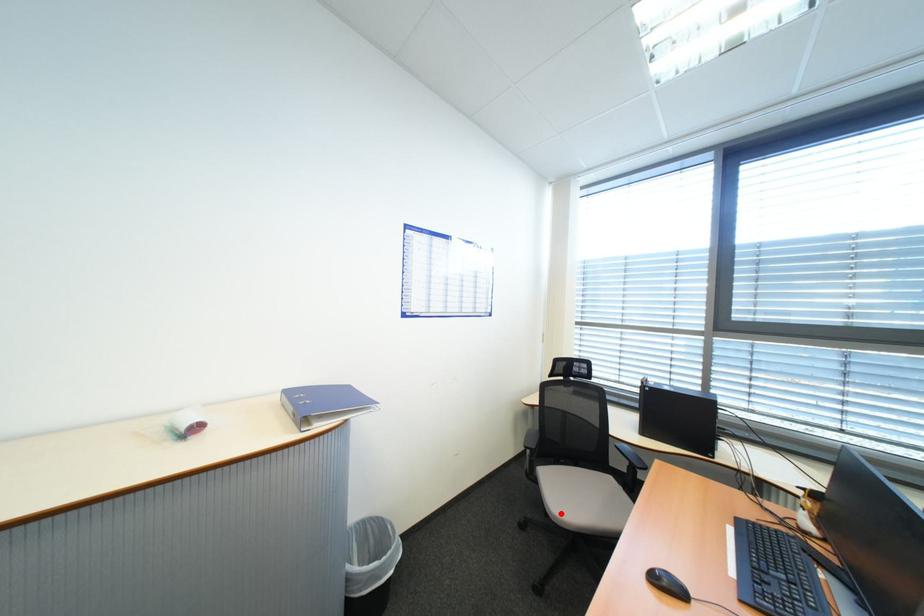
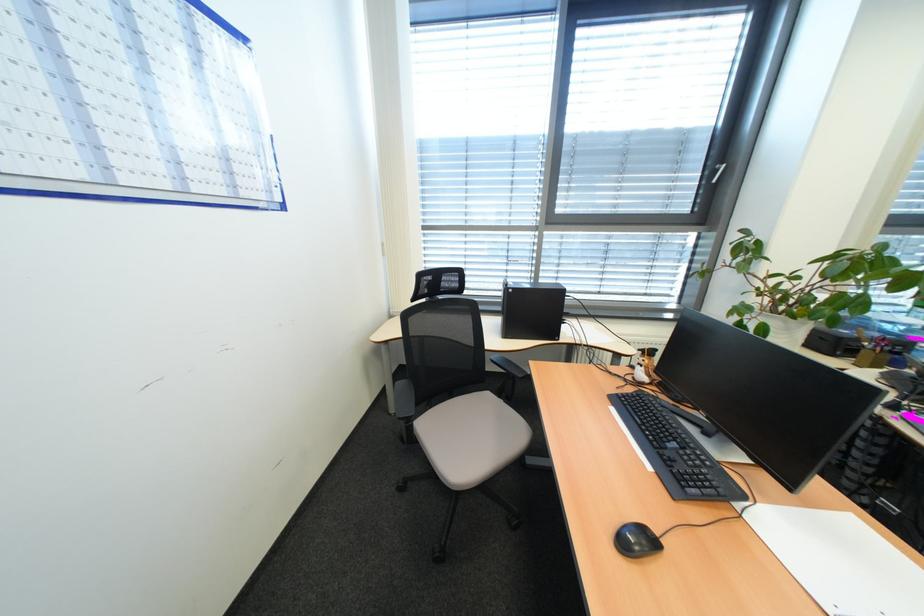
Question: I am providing you with two images of the same scene from different viewpoints. In image1, a red point is highlighted. Considering the same 3D point in image2, which of the following is correct?

Choices:
 (A) It is closer
 (B) It is farther

Answer: (B)